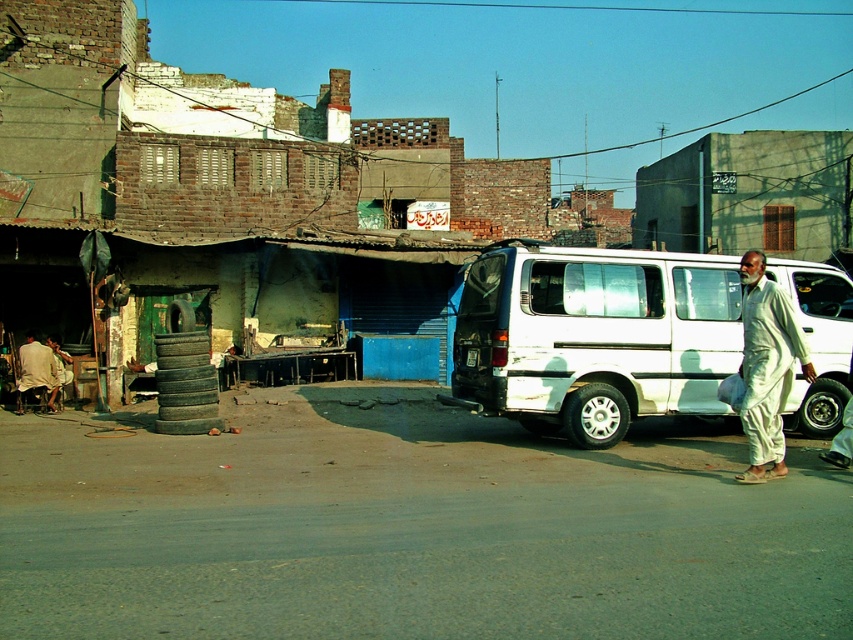
Does light brown fabric shirt at lower left appear on the right side of light beige fabric at lower left?

In fact, light brown fabric shirt at lower left is to the left of light beige fabric at lower left.

Which is more to the right, light brown fabric shirt at lower left or light beige fabric at lower left?

Positioned to the right is light beige fabric at lower left.

Who is more forward, (54,374) or (62,376)?

Point (54,374) is in front.

This screenshot has width=853, height=640. I want to click on light brown fabric shirt at lower left, so click(x=36, y=371).

Between white matte van at right and green concrete wall at upper right, which one appears on the left side from the viewer's perspective?

From the viewer's perspective, white matte van at right appears more on the left side.

Can you confirm if white matte van at right is positioned to the left of green concrete wall at upper right?

Yes, white matte van at right is to the left of green concrete wall at upper right.

The image size is (853, 640). I want to click on white matte van at right, so click(x=595, y=337).

Where is `white matte van at right`? This screenshot has height=640, width=853. white matte van at right is located at coordinates (595, 337).

Does point (824, 220) come farther from viewer compared to point (61, 371)?

Yes, point (824, 220) is farther from viewer.

Which is behind, point (692, 161) or point (55, 365)?

The point (692, 161) is behind.

Find the location of a particular element. The height and width of the screenshot is (640, 853). green concrete wall at upper right is located at coordinates (749, 195).